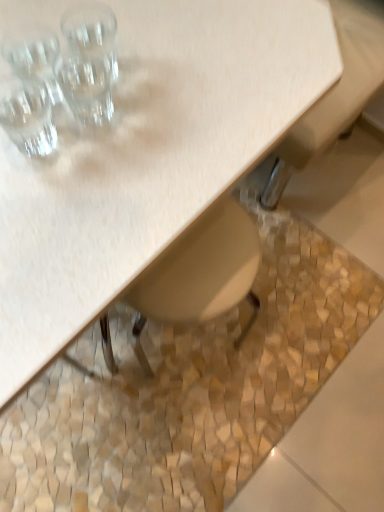
Find the location of a particular element. The image size is (384, 512). free spot above beige mosaic tile at lower center (from a real-world perspective) is located at coordinates (269, 349).